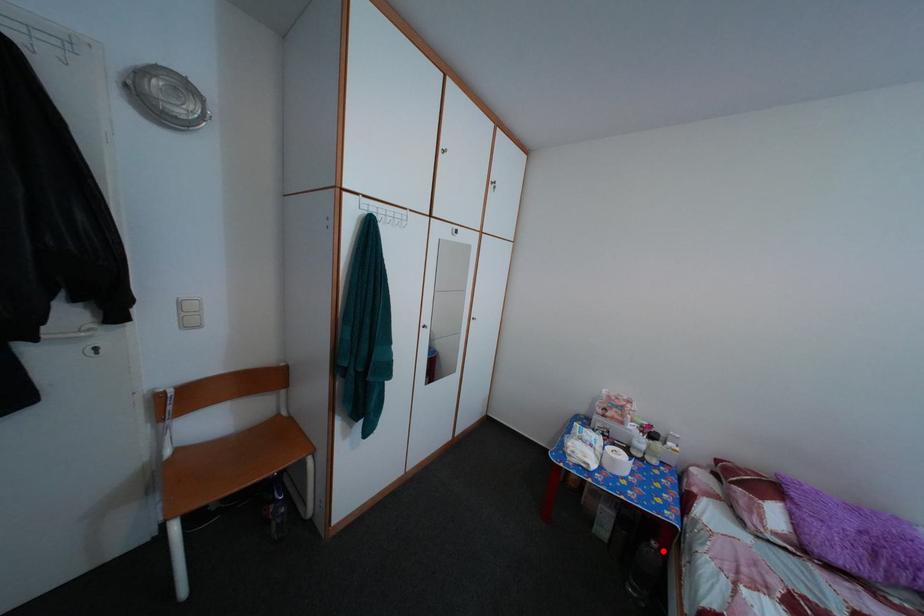
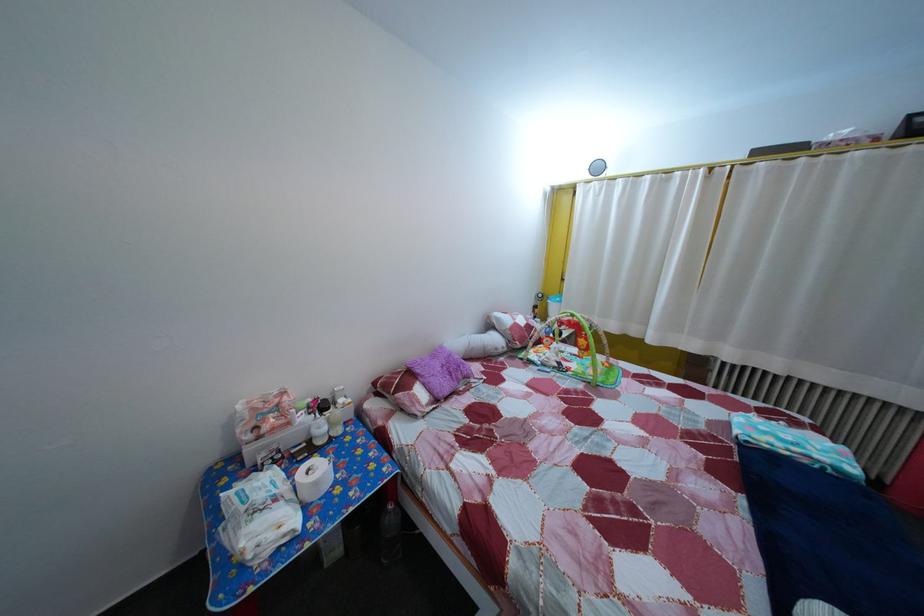
Question: I am providing you with two images of the same scene from different viewpoints. Given a red point in image1, look at the same physical point in image2. Is it:

Choices:
 (A) Closer to the viewpoint
 (B) Farther from the viewpoint

Answer: (B)